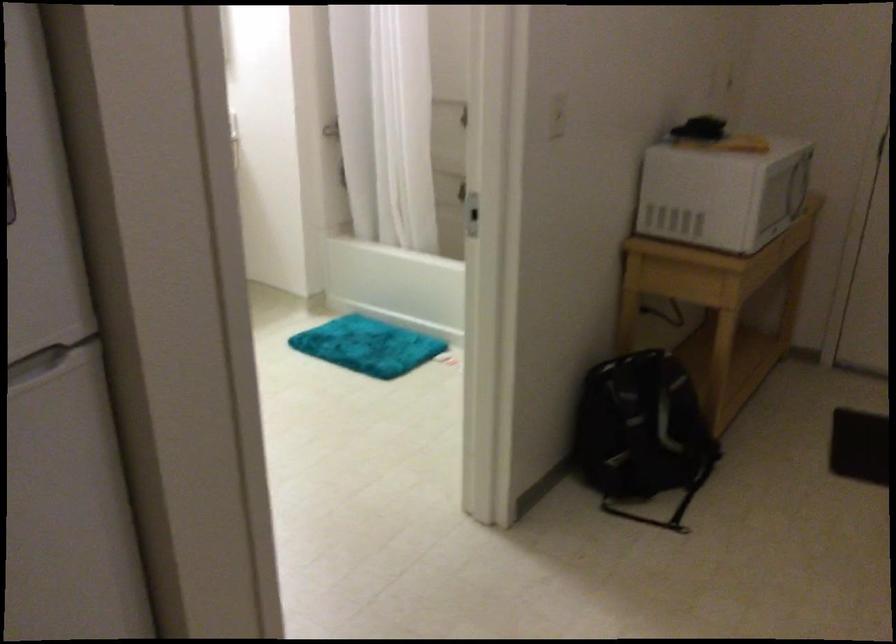
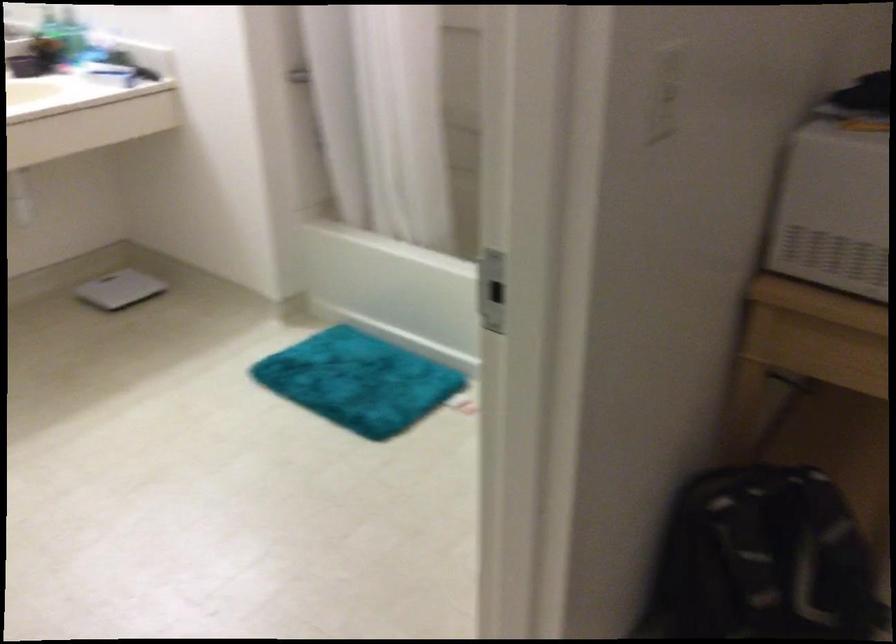
Locate, in the second image, the point that corresponds to the point at 557,108 in the first image.

(666, 93)